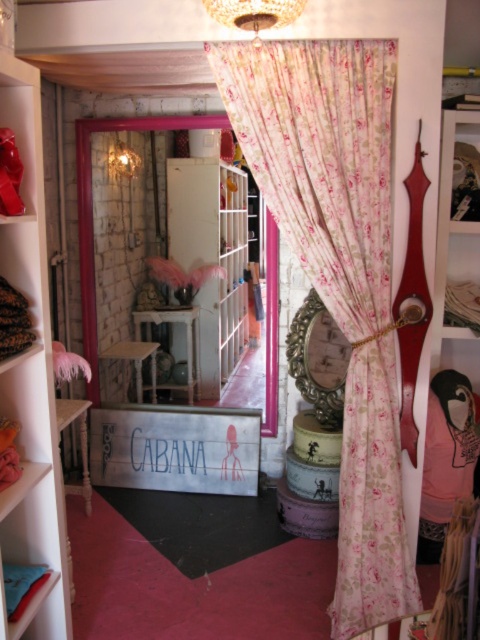
You are an interior designer planning to install a new light fixture. You need to know the distance between the white wood shelf at left and the crystal glass chandelier at upper center. Can you provide the exact measurement?

The white wood shelf at left is 37.43 inches from the crystal glass chandelier at upper center.

You are an interior designer planning to install a new lighting fixture. You have a choice between the floral fabric curtain at center and the crystal glass chandelier at upper center. Which object is wider and would require more horizontal space for installation?

The floral fabric curtain at center is wider than the crystal glass chandelier at upper center, so it would require more horizontal space for installation.

You are trying to decide whether to place a large painting on the wall behind the floral fabric curtain at center or on the wall next to the white wood shelf at left. Based on the size of the objects, which location would be more appropriate for the painting?

The floral fabric curtain at center has a larger size compared to white wood shelf at left, so placing the large painting behind the floral fabric curtain at center would be more appropriate as it can accommodate the painting better.